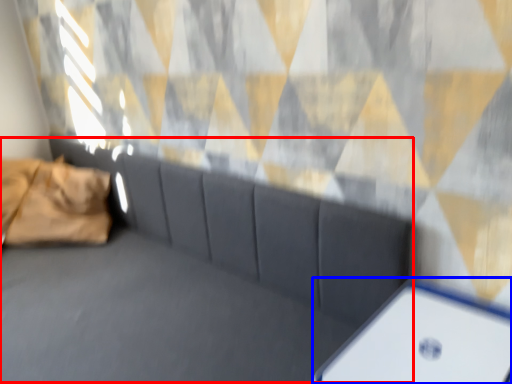
Question: Which object appears closest to the camera in this image, couch (highlighted by a red box) or furniture (highlighted by a blue box)?

Choices:
 (A) couch
 (B) furniture

Answer: (A)